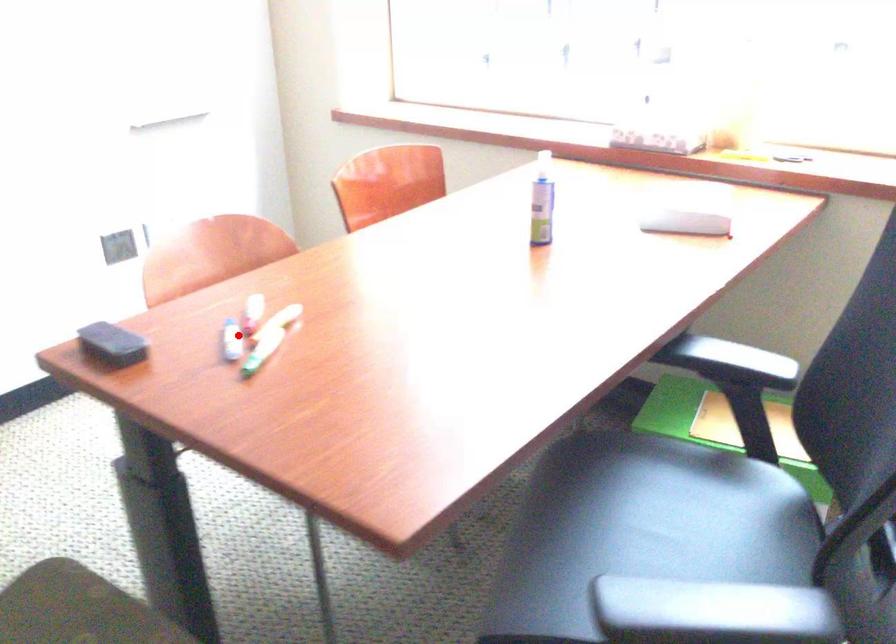
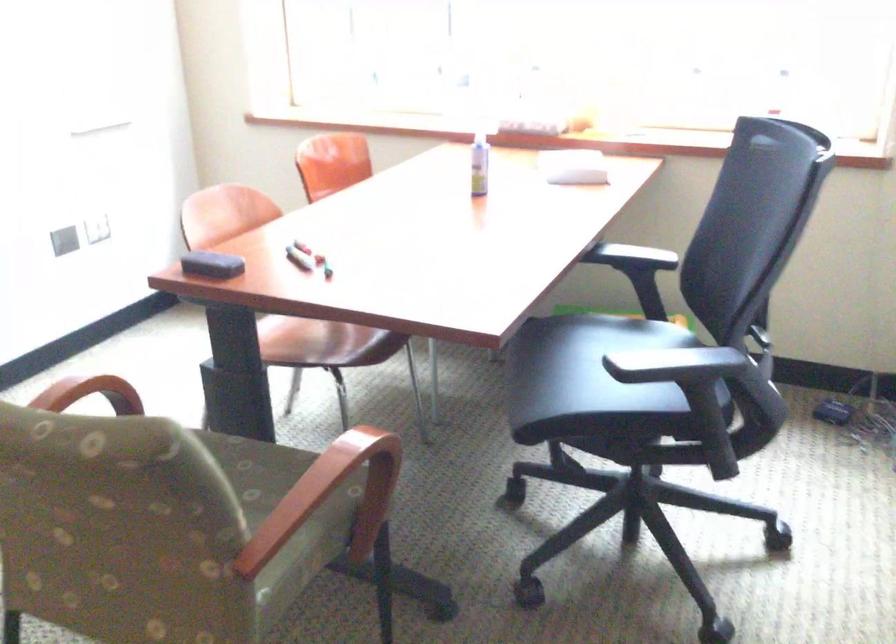
Question: I am providing you with two images of the same scene from different viewpoints. In image1, a red point is highlighted. Considering the same 3D point in image2, which of the following is correct?

Choices:
 (A) It is closer
 (B) It is farther

Answer: (B)